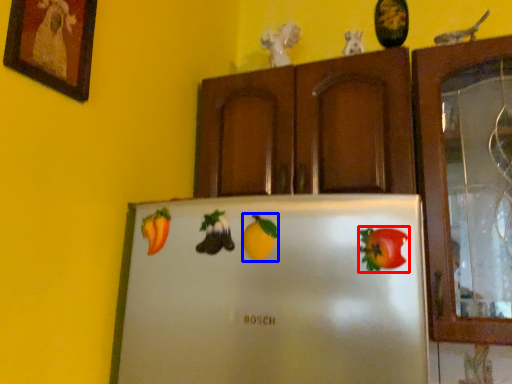
Question: Among these objects, which one is nearest to the camera, fruit (highlighted by a red box) or fruit (highlighted by a blue box)?

Choices:
 (A) fruit
 (B) fruit

Answer: (A)